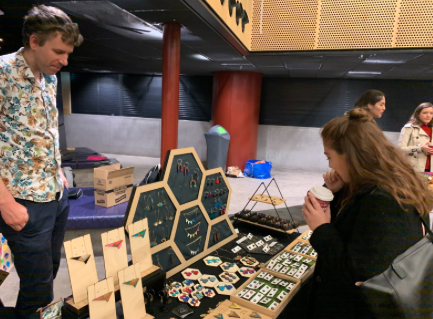
Image resolution: width=433 pixels, height=319 pixels. What are the coordinates of `thin red building support column` in the screenshot? It's located at (171, 118).